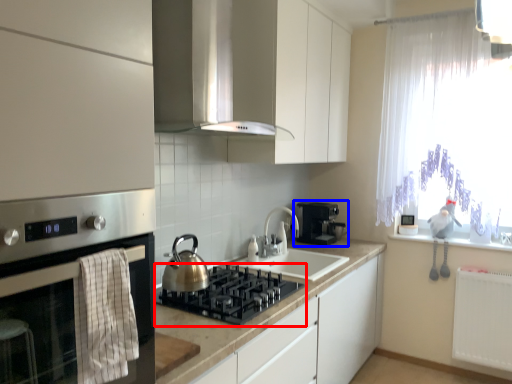
Question: Which of the following is the closest to the observer, gas stove (highlighted by a red box) or coffee machine (highlighted by a blue box)?

Choices:
 (A) gas stove
 (B) coffee machine

Answer: (A)